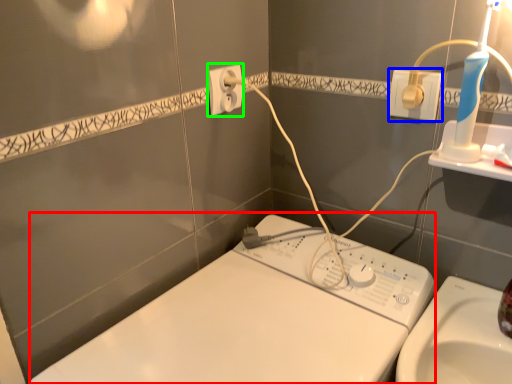
Question: Which is nearer to the machine (highlighted by a red box)? power plugs and sockets (highlighted by a blue box) or power plugs and sockets (highlighted by a green box).

Choices:
 (A) power plugs and sockets
 (B) power plugs and sockets

Answer: (B)